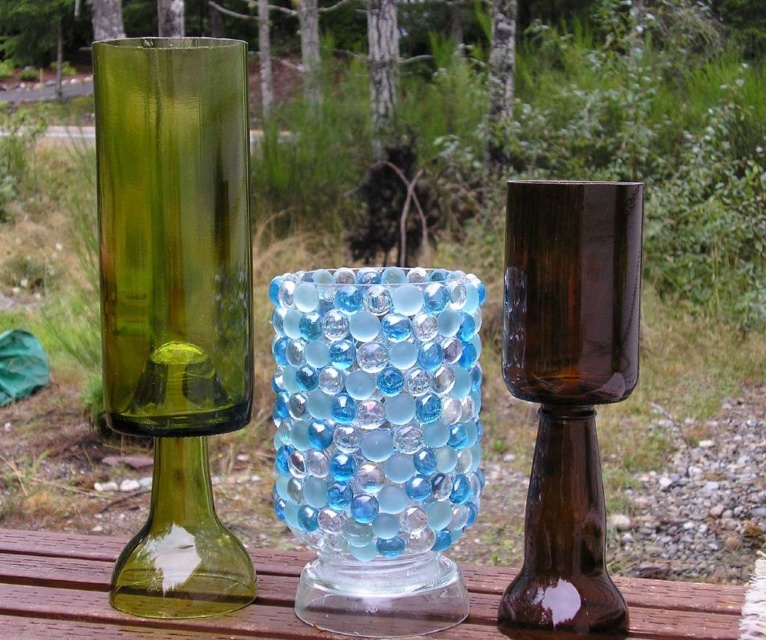
You are planning to stack the translucent blue glass vase at center and the brown glass goblet at center on top of each other. Which one should be placed at the bottom to ensure stability?

The brown glass goblet at center should be placed at the bottom since it is taller than the translucent blue glass vase at center, providing a more stable base.

You are a delivery person who needs to place a new brown glass goblet at center onto the wooden surface without touching the translucent blue glass vase at center. Given their sizes, can you fit the new goblet next to the existing one without moving any other objects?

The translucent blue glass vase at center is wider than the brown glass goblet at center. Since the new goblet needs to be placed next to the existing vase, there should be enough space as long as the surface allows, but since the vase is wider, the goblet might fit beside it depending on the surface area available. However, without knowing the exact surface dimensions, it is hard to confirm. The description only states the vase is wider, not the total space available.

You are setting up a picnic table in the forest. You have a green glass vase at left and a transparent glass table at center. Which object should you avoid placing heavy items on to prevent breakage?

The green glass vase at left is smaller than the transparent glass table at center, so you should avoid placing heavy items on the green glass vase at left as it is more fragile due to its smaller size and structure.